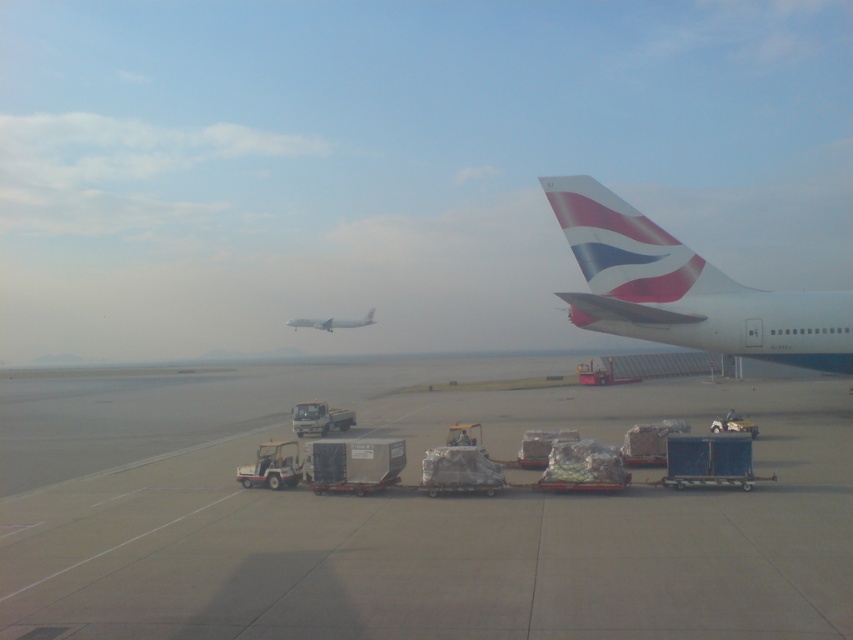
Who is positioned more to the left, smooth concrete tarmac at center or white matte airplane at center?

From the viewer's perspective, white matte airplane at center appears more on the left side.

The width and height of the screenshot is (853, 640). I want to click on smooth concrete tarmac at center, so click(408, 515).

Which of these two, polished aluminum airplane at right or white matte airplane at center, stands shorter?

white matte airplane at center

Which is behind, point (698, 301) or point (300, 320)?

Point (300, 320)

Which is behind, point (664, 339) or point (372, 314)?

Point (372, 314)

This screenshot has width=853, height=640. I want to click on polished aluminum airplane at right, so click(685, 289).

Which is in front, point (642, 531) or point (769, 301)?

Point (642, 531)

In the scene shown: Which is above, smooth concrete tarmac at center or polished aluminum airplane at right?

Positioned higher is polished aluminum airplane at right.

Between point (645, 518) and point (846, 316), which one is positioned in front?

Point (645, 518)

The width and height of the screenshot is (853, 640). What are the coordinates of `smooth concrete tarmac at center` in the screenshot? It's located at (408, 515).